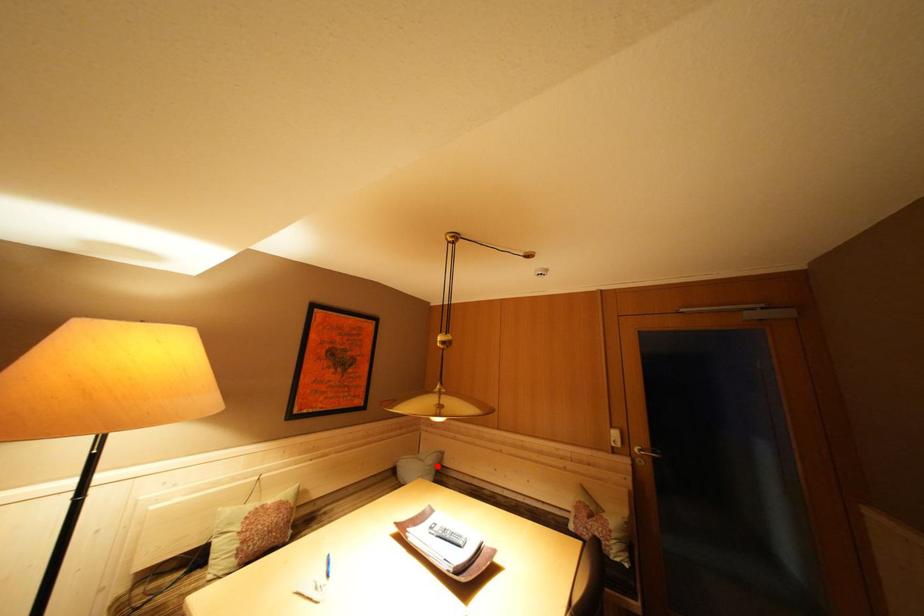
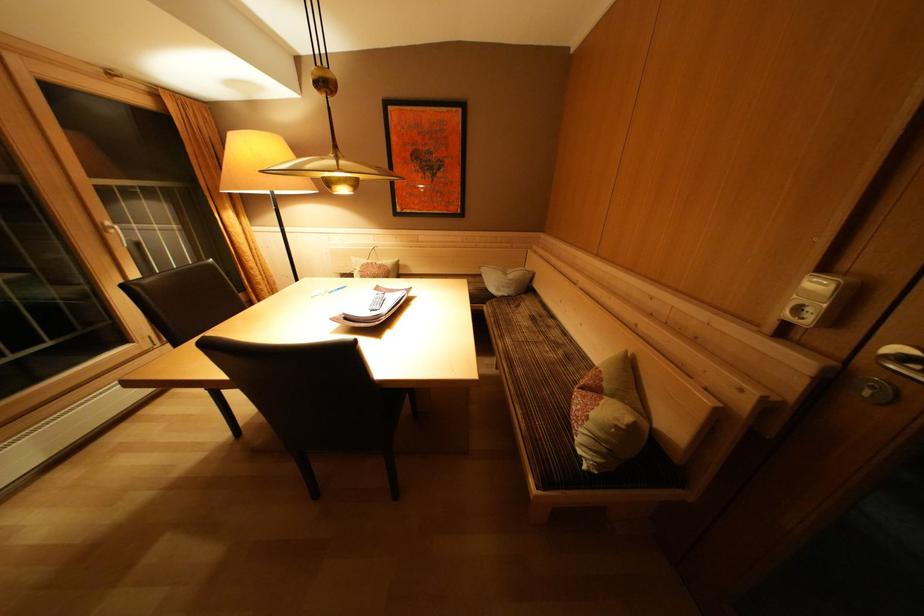
In the second image, find the point that corresponds to the highlighted location in the first image.

(517, 281)